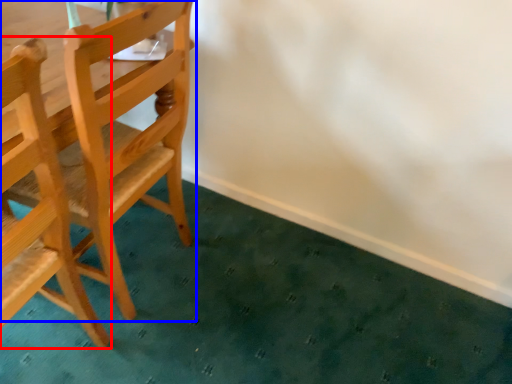
Question: Among these objects, which one is nearest to the camera, chair (highlighted by a red box) or chair (highlighted by a blue box)?

Choices:
 (A) chair
 (B) chair

Answer: (A)